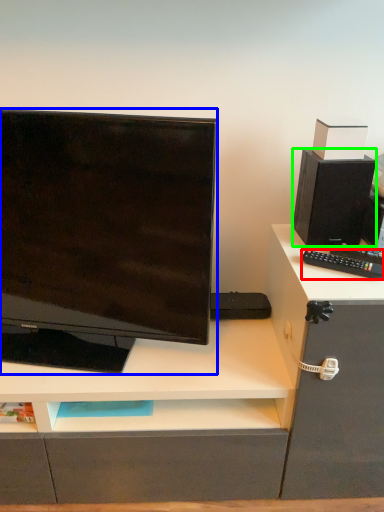
Question: Estimate the real-world distances between objects in this image. Which object is farther from remote control (highlighted by a red box), computer monitor (highlighted by a blue box) or speaker (highlighted by a green box)?

Choices:
 (A) computer monitor
 (B) speaker

Answer: (A)